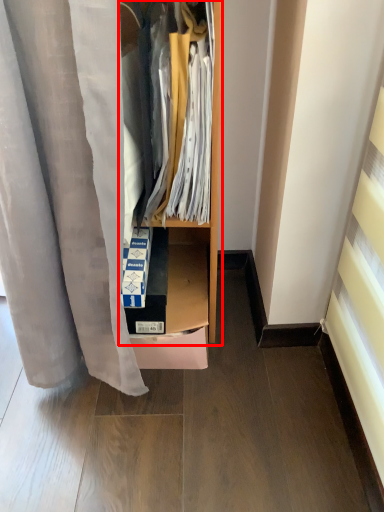
Question: From the image's perspective, what is the correct spatial positioning of dresser (annotated by the red box) in reference to shelf?

Choices:
 (A) above
 (B) below

Answer: (A)